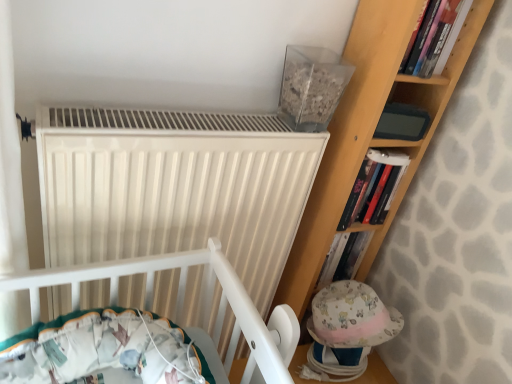
Question: Is there a large distance between white matte radiator at upper center and hardcover book at upper right, positioned as the second book in bottom-to-top order?

Choices:
 (A) no
 (B) yes

Answer: (A)

Question: Is white matte radiator at upper center in contact with hardcover book at upper right, positioned as the 1th book in top-to-bottom order?

Choices:
 (A) yes
 (B) no

Answer: (B)

Question: Can you confirm if white matte radiator at upper center is shorter than hardcover book at upper right, arranged as the first book when viewed from the front?

Choices:
 (A) no
 (B) yes

Answer: (A)

Question: Does white matte radiator at upper center have a greater height compared to hardcover book at upper right, the 2th book when ordered from back to front?

Choices:
 (A) yes
 (B) no

Answer: (A)

Question: Would you say hardcover book at upper right, arranged as the first book when viewed from the front, is part of white matte radiator at upper center's contents?

Choices:
 (A) no
 (B) yes

Answer: (A)

Question: Does white matte radiator at upper center have a lesser width compared to hardcover book at upper right, positioned as the second book in bottom-to-top order?

Choices:
 (A) yes
 (B) no

Answer: (B)

Question: From the image's perspective, is white matte radiator at upper center beneath hardcover book at upper right, the second book from the front?

Choices:
 (A) no
 (B) yes

Answer: (B)

Question: Is white matte radiator at upper center smaller than hardcover book at upper right, the second book from the front?

Choices:
 (A) yes
 (B) no

Answer: (B)

Question: Is hardcover book at upper right, positioned as the second book in top-to-bottom order, inside white matte radiator at upper center?

Choices:
 (A) yes
 (B) no

Answer: (B)

Question: From a real-world perspective, does white matte radiator at upper center stand above hardcover book at upper right, which ranks as the 1th book in back-to-front order?

Choices:
 (A) no
 (B) yes

Answer: (A)

Question: Does white matte radiator at upper center have a lesser width compared to hardcover book at upper right, which ranks as the 1th book in back-to-front order?

Choices:
 (A) no
 (B) yes

Answer: (A)

Question: From the image's perspective, does white matte radiator at upper center appear higher than hardcover book at upper right, positioned as the second book in top-to-bottom order?

Choices:
 (A) no
 (B) yes

Answer: (A)

Question: From a real-world perspective, does hardcover book at upper right, the second book from the front, sit lower than hardcover book at upper right, positioned as the second book in bottom-to-top order?

Choices:
 (A) yes
 (B) no

Answer: (A)